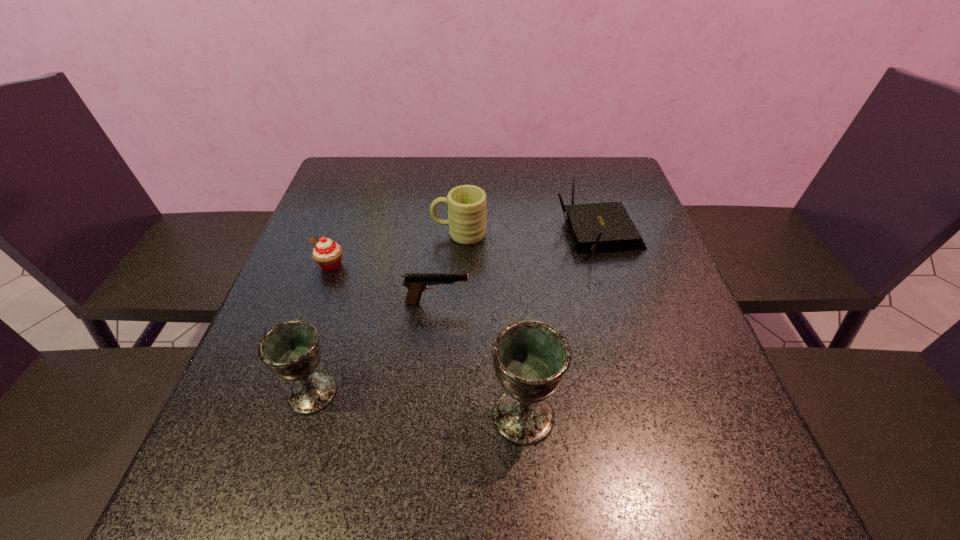
Considering the uniform spacing of chalices, where should an additional chalice be positioned on the right? Please locate a free spot. Please provide its 2D coordinates. Your answer should be formatted as a tuple, i.e. [(x, y)], where the tuple contains the x and y coordinates of a point satisfying the conditions above.

[(753, 440)]